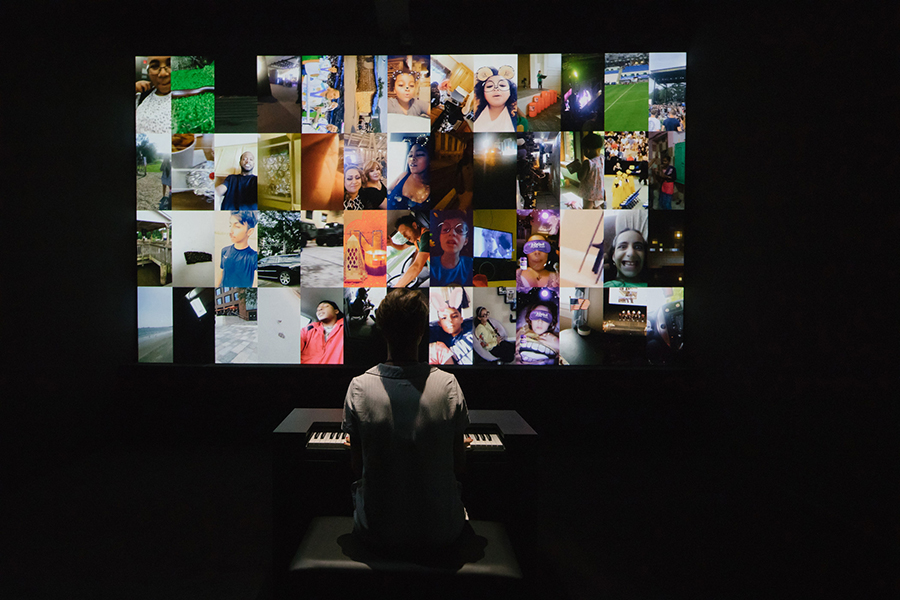
You are a GUI agent. You are given a task and a screenshot of the screen. Output one action in this format:
    pyautogui.click(x=<x>, y=<y>)
    Task: Click on the tv
    
    Given the screenshot: What is the action you would take?
    pyautogui.click(x=497, y=245)